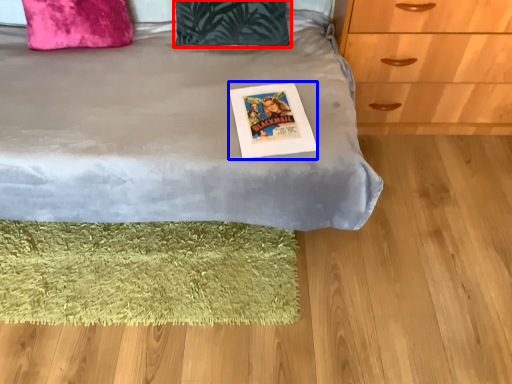
Question: Among these objects, which one is farthest to the camera, pillow (highlighted by a red box) or postcard (highlighted by a blue box)?

Choices:
 (A) pillow
 (B) postcard

Answer: (A)